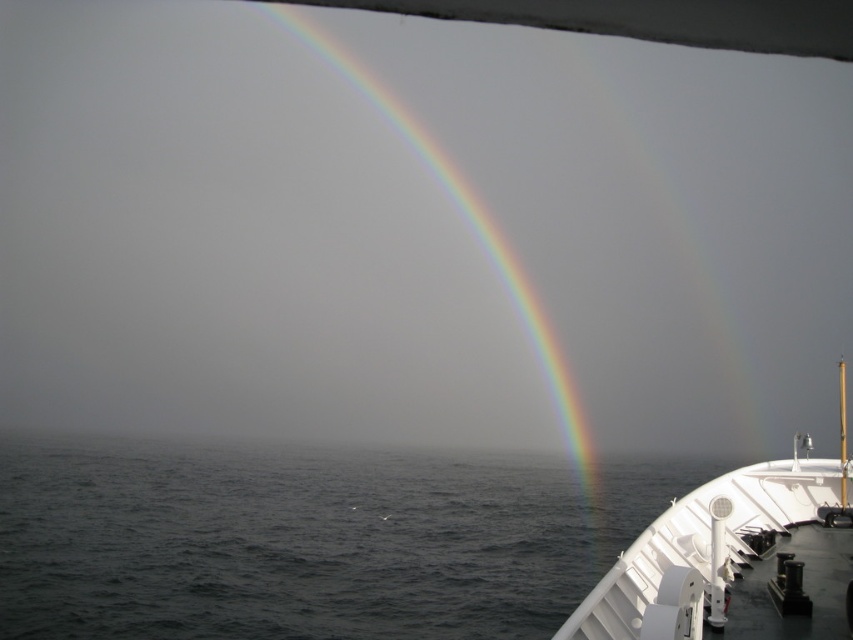
Question: Can you confirm if dark blue water at lower left is bigger than rainbow at upper center?

Choices:
 (A) no
 (B) yes

Answer: (A)

Question: Which object is closer to the camera taking this photo?

Choices:
 (A) rainbow at upper center
 (B) white matte boat at lower right

Answer: (A)

Question: Is dark blue water at lower left thinner than rainbow at upper center?

Choices:
 (A) no
 (B) yes

Answer: (A)

Question: Among these points, which one is farthest from the camera?

Choices:
 (A) (393, 566)
 (B) (810, 572)
 (C) (314, 36)

Answer: (C)

Question: Is white matte boat at lower right thinner than rainbow at upper center?

Choices:
 (A) no
 (B) yes

Answer: (B)

Question: Among these points, which one is nearest to the camera?

Choices:
 (A) (635, 525)
 (B) (357, 70)
 (C) (727, 598)

Answer: (C)